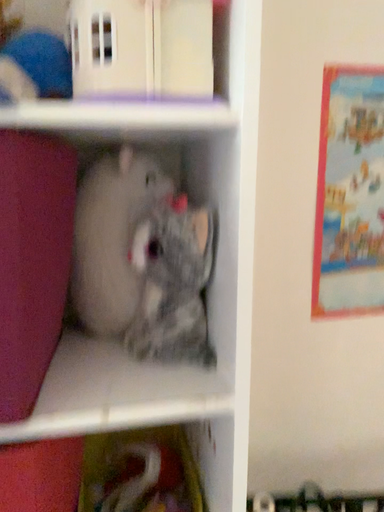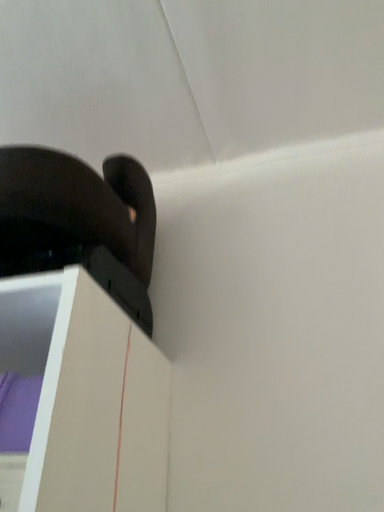
Question: Which way did the camera rotate in the video?

Choices:
 (A) rotated downward
 (B) rotated upward

Answer: (B)